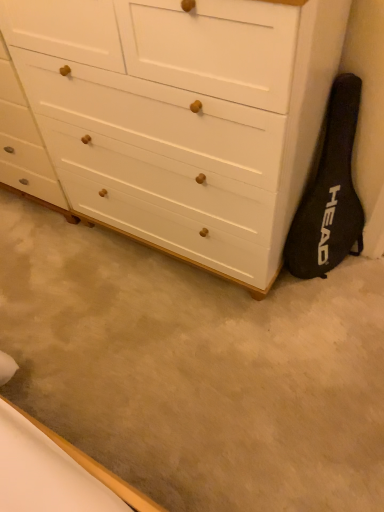
You are a GUI agent. You are given a task and a screenshot of the screen. Output one action in this format:
    pyautogui.click(x=<x>, y=<y>)
    Task: Click on the free space above beige carpet at lower center (from a real-world perspective)
    Image resolution: width=384 pixels, height=512 pixels.
    Given the screenshot: What is the action you would take?
    pyautogui.click(x=146, y=317)